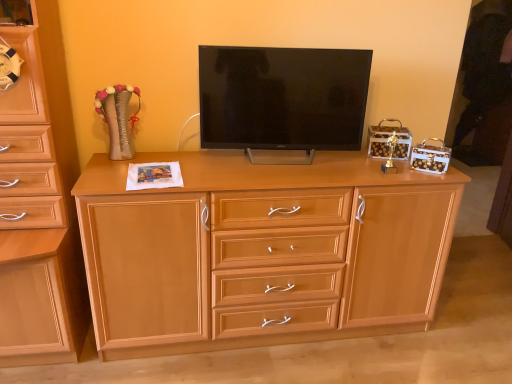
Question: Can you confirm if matte wood chest of drawers at left, the second chest of drawers viewed from the right, is positioned to the left of light wood chest of drawers at center, which is the second chest of drawers from left to right?

Choices:
 (A) no
 (B) yes

Answer: (B)

Question: Can you confirm if matte wood chest of drawers at left, the second chest of drawers viewed from the right, is bigger than light wood chest of drawers at center, which is the second chest of drawers from left to right?

Choices:
 (A) yes
 (B) no

Answer: (B)

Question: Does matte wood chest of drawers at left, the 1th chest of drawers viewed from the left, appear on the right side of light wood chest of drawers at center, which appears as the 1th chest of drawers when viewed from the right?

Choices:
 (A) no
 (B) yes

Answer: (A)

Question: Is matte wood chest of drawers at left, the 1th chest of drawers viewed from the left, with light wood chest of drawers at center, which appears as the 1th chest of drawers when viewed from the right?

Choices:
 (A) no
 (B) yes

Answer: (A)

Question: Is matte wood chest of drawers at left, the second chest of drawers viewed from the right, not near light wood chest of drawers at center, which appears as the 1th chest of drawers when viewed from the right?

Choices:
 (A) yes
 (B) no

Answer: (B)

Question: Can you confirm if matte wood chest of drawers at left, the 1th chest of drawers viewed from the left, is wider than light wood chest of drawers at center, which appears as the 1th chest of drawers when viewed from the right?

Choices:
 (A) no
 (B) yes

Answer: (B)

Question: Is matte black tv at center positioned in front of matte wood chest of drawers at left, the 1th chest of drawers viewed from the left?

Choices:
 (A) no
 (B) yes

Answer: (A)

Question: Is matte black tv at center facing away from matte wood chest of drawers at left, the second chest of drawers viewed from the right?

Choices:
 (A) no
 (B) yes

Answer: (A)

Question: Considering the relative sizes of matte black tv at center and matte wood chest of drawers at left, the 1th chest of drawers viewed from the left, in the image provided, is matte black tv at center smaller than matte wood chest of drawers at left, the 1th chest of drawers viewed from the left,?

Choices:
 (A) yes
 (B) no

Answer: (A)

Question: Is matte wood chest of drawers at left, the second chest of drawers viewed from the right, completely or partially inside matte black tv at center?

Choices:
 (A) no
 (B) yes

Answer: (A)

Question: Does matte black tv at center have a greater width compared to matte wood chest of drawers at left, the second chest of drawers viewed from the right?

Choices:
 (A) yes
 (B) no

Answer: (B)

Question: From a real-world perspective, is matte black tv at center physically below matte wood chest of drawers at left, the 1th chest of drawers viewed from the left?

Choices:
 (A) yes
 (B) no

Answer: (B)

Question: Can light wood chest of drawers at center, which appears as the 1th chest of drawers when viewed from the right, be found inside matte black tv at center?

Choices:
 (A) yes
 (B) no

Answer: (B)